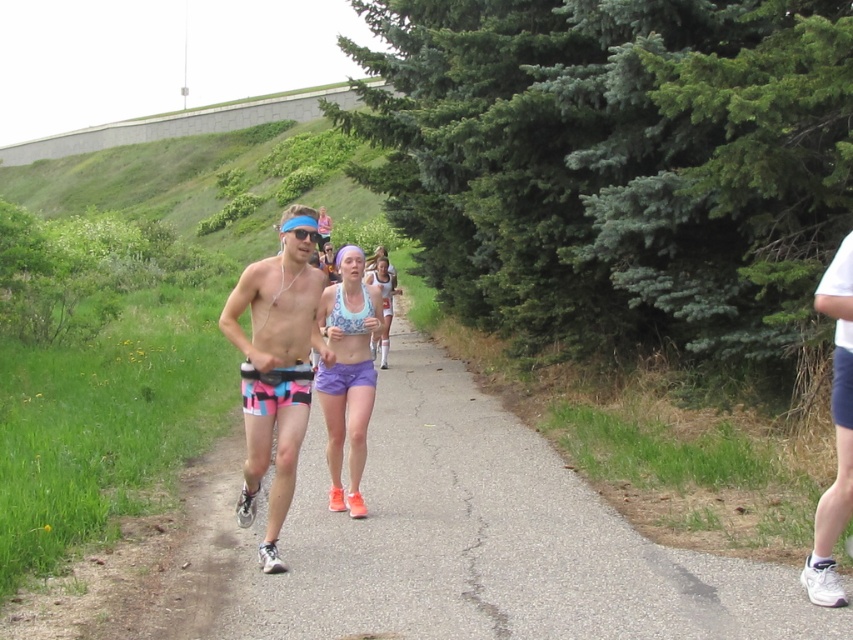
Who is positioned more to the left, neon pink spandex shorts at center or white matte bikini top at center?

Positioned to the left is neon pink spandex shorts at center.

Who is positioned more to the right, neon pink spandex shorts at center or white matte bikini top at center?

Positioned to the right is white matte bikini top at center.

Is point (271, 508) positioned behind point (357, 333)?

No, it is not.

Locate an element on the screen. The width and height of the screenshot is (853, 640). neon pink spandex shorts at center is located at coordinates (276, 365).

Which is below, neon pink spandex shorts at center or white cotton shirt at right?

Positioned lower is neon pink spandex shorts at center.

In the scene shown: Does neon pink spandex shorts at center have a greater height compared to white cotton shirt at right?

Correct, neon pink spandex shorts at center is much taller as white cotton shirt at right.

Between point (221, 323) and point (834, 596), which one is positioned behind?

The point (221, 323) is behind.

Where is `neon pink spandex shorts at center`? neon pink spandex shorts at center is located at coordinates (276, 365).

Measure the distance between white cotton shirt at right and camera.

white cotton shirt at right and camera are 5.41 meters apart.

Image resolution: width=853 pixels, height=640 pixels. What do you see at coordinates (834, 433) in the screenshot?
I see `white cotton shirt at right` at bounding box center [834, 433].

Between point (830, 292) and point (341, 304), which one is positioned behind?

The point (341, 304) is behind.

At what (x,y) coordinates should I click in order to perform the action: click on white cotton shirt at right. Please return your answer as a coordinate pair (x, y). This screenshot has width=853, height=640. Looking at the image, I should click on (834, 433).